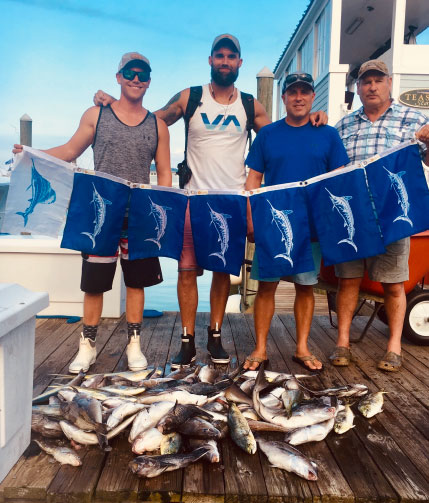
Image resolution: width=429 pixels, height=503 pixels. Identify the location of bin. (33, 349).